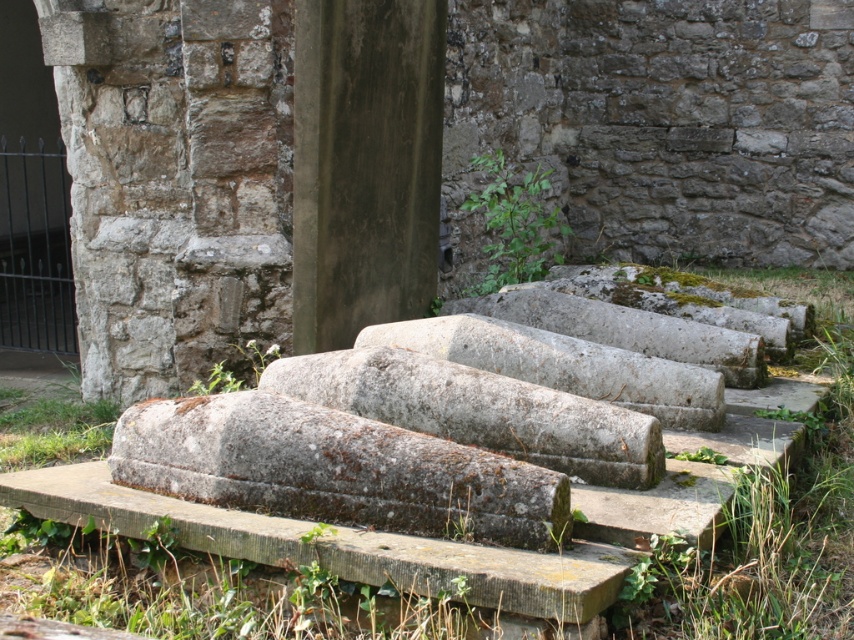
You are an archaeologist examining the site. You notice the gray stone sarcophagi at center and the smooth concrete pillar at center. Based on their positions, which one is closer to the ground?

The gray stone sarcophagi at center is located below the smooth concrete pillar at center, so it is closer to the ground.

You are standing in a historical burial ground and see the green mossy grass at center. If you want to take a photo of it from where you are standing, will the grass be in the foreground or background of your photo?

The green mossy grass at center is 7.69 feet away from the camera, so it will be in the foreground of the photo since it is relatively close to the camera.

You are a groundskeeper tasked with mowing the green mossy grass at center. The gray stone sarcophagi at center is in the way. Can you move the sarcophagi to make space for mowing?

The gray stone sarcophagi at center has a lesser width compared to green mossy grass at center, so moving the sarcophagi might not be necessary as it is narrower than the grass area. However, the sarcophagi are large stone structures and likely immovable, so you should mow around them instead.